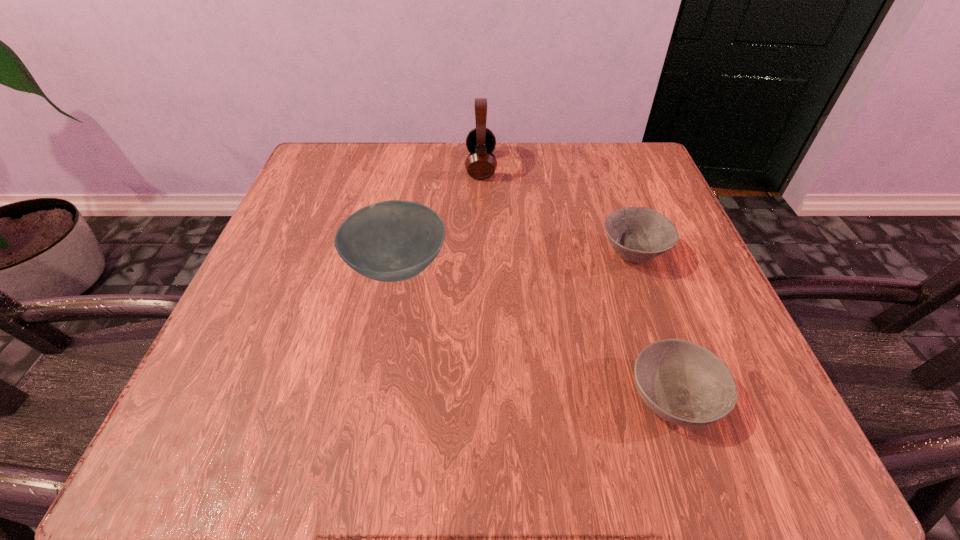
In the image, there is a desktop. Where is `vacant space at the right edge`? Image resolution: width=960 pixels, height=540 pixels. vacant space at the right edge is located at coordinates (742, 341).

I want to click on vacant space at the far left corner of the desktop, so click(x=370, y=178).

The image size is (960, 540). I want to click on vacant point at the far right corner, so click(589, 146).

Identify the location of unoccupied position between the second tallest bowl and the leftmost bowl. (515, 261).

Image resolution: width=960 pixels, height=540 pixels. In order to click on free space between the nearest bowl and the third object from right to left in this screenshot , I will do `click(577, 281)`.

At what (x,y) coordinates should I click in order to perform the action: click on free space between the third object from right to left and the nearest object. Please return your answer as a coordinate pair (x, y). The width and height of the screenshot is (960, 540). Looking at the image, I should click on (577, 281).

This screenshot has height=540, width=960. Find the location of `vacant area between the nearest object and the leftmost object`. vacant area between the nearest object and the leftmost object is located at coordinates (535, 332).

Identify the location of unoccupied position between the third tallest object and the leftmost object. The width and height of the screenshot is (960, 540). (x=515, y=261).

The image size is (960, 540). Identify the location of unoccupied position between the third shortest object and the nearest bowl. (535, 332).

Image resolution: width=960 pixels, height=540 pixels. I want to click on vacant space that is in between the shortest bowl and the second tallest bowl, so click(654, 326).